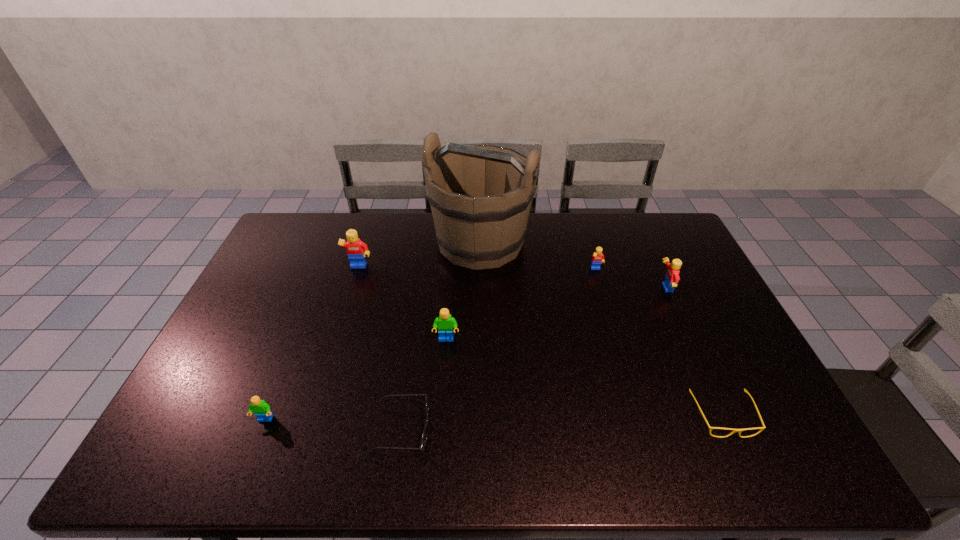
Identify the location of the nearest Lego. The image size is (960, 540). tap(262, 410).

This screenshot has height=540, width=960. Find the location of `the left spectacles`. the left spectacles is located at coordinates (424, 439).

At what (x,y) coordinates should I click in order to perform the action: click on the right spectacles. Please return your answer as a coordinate pair (x, y). Looking at the image, I should click on (711, 428).

Identify the location of free space located on the front of the bucket. (480, 313).

Locate an element on the screen. Image resolution: width=960 pixels, height=540 pixels. vacant space located 0.270m on the face of the biggest yellow Lego is located at coordinates (338, 335).

This screenshot has height=540, width=960. I want to click on vacant region located on the face of the second smallest yellow Lego, so click(x=596, y=288).

Image resolution: width=960 pixels, height=540 pixels. I want to click on vacant area situated 0.290m on the face of the second smallest yellow Lego, so click(568, 288).

Identify the location of free spot located on the face of the second smallest yellow Lego. This screenshot has width=960, height=540. point(571,288).

You are a GUI agent. You are given a task and a screenshot of the screen. Output one action in this format:
    pyautogui.click(x=<x>, y=<y>)
    Task: Click on the vacant space located on the face of the right green Lego
    The height and width of the screenshot is (540, 960).
    Given the screenshot: What is the action you would take?
    pyautogui.click(x=444, y=382)

Image resolution: width=960 pixels, height=540 pixels. In order to click on free spot located 0.380m on the face of the second yellow Lego from right to left in this screenshot , I will do `click(624, 364)`.